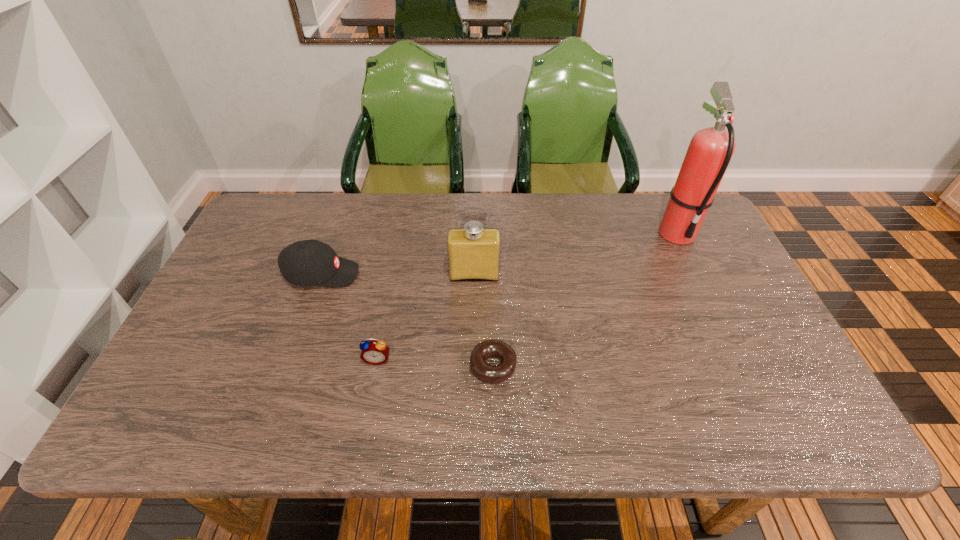
In order to click on the tallest object in this screenshot , I will do `click(709, 153)`.

The height and width of the screenshot is (540, 960). I want to click on fire extinguisher, so click(709, 153).

Image resolution: width=960 pixels, height=540 pixels. Find the location of `the fourth shortest object`. the fourth shortest object is located at coordinates (x=473, y=251).

This screenshot has height=540, width=960. I want to click on baseball cap, so click(311, 262).

This screenshot has width=960, height=540. I want to click on the leftmost object, so click(311, 262).

Locate an element on the screen. This screenshot has width=960, height=540. the second object from left to right is located at coordinates (373, 352).

Locate an element on the screen. alarm clock is located at coordinates (373, 352).

This screenshot has width=960, height=540. I want to click on the shortest object, so click(x=484, y=371).

Identify the location of free space located 0.300m on the hose direction of the rightmost object. Image resolution: width=960 pixels, height=540 pixels. (726, 335).

The height and width of the screenshot is (540, 960). In order to click on vacant point located on the front-facing side of the second tallest object in this screenshot , I will do `click(473, 338)`.